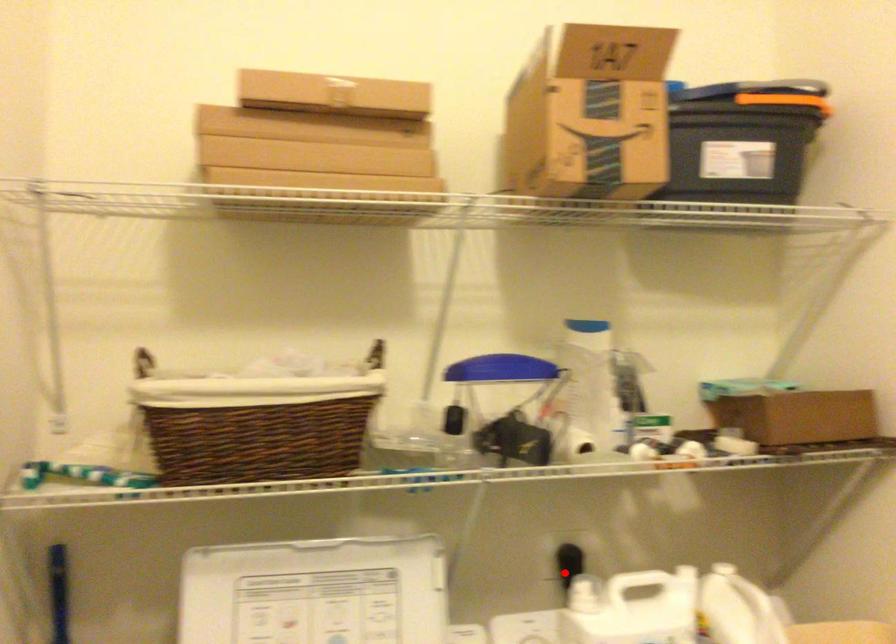
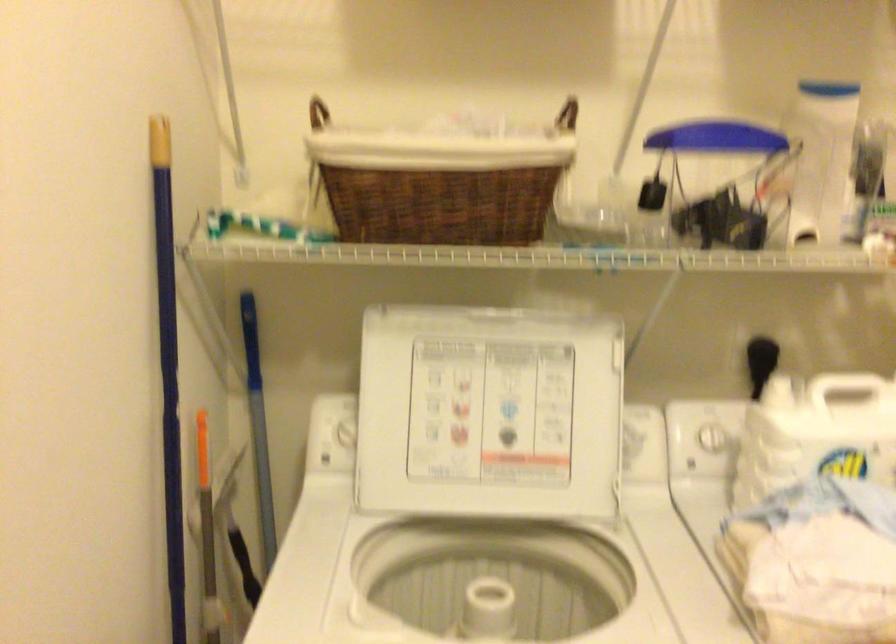
Locate, in the second image, the point that corresponds to the highlighted location in the first image.

(760, 362)